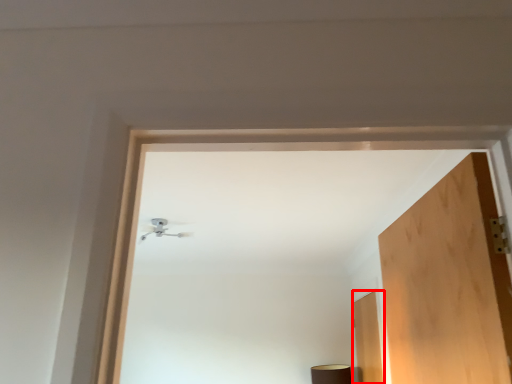
Question: Considering the relative positions of door (annotated by the red box) and lamp in the image provided, where is door (annotated by the red box) located with respect to the staircase?

Choices:
 (A) right
 (B) left

Answer: (A)